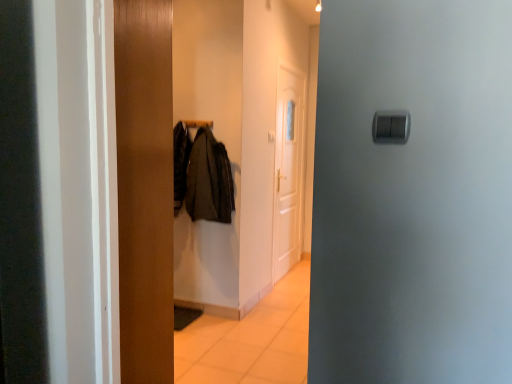
Question: From the image's perspective, is dark gray fabric coat at center beneath wooden door at center, arranged as the 2th door when viewed from the right?

Choices:
 (A) no
 (B) yes

Answer: (A)

Question: Is dark gray fabric coat at center aimed at wooden door at center, which is the 1th door from front to back?

Choices:
 (A) no
 (B) yes

Answer: (B)

Question: Does dark gray fabric coat at center have a larger size compared to wooden door at center, which is counted as the 1th door, starting from the left?

Choices:
 (A) no
 (B) yes

Answer: (A)

Question: Are dark gray fabric coat at center and wooden door at center, which is the 1th door from front to back, located far from each other?

Choices:
 (A) yes
 (B) no

Answer: (A)

Question: From the image's perspective, is dark gray fabric coat at center above wooden door at center, which is counted as the 1th door, starting from the left?

Choices:
 (A) yes
 (B) no

Answer: (A)

Question: Is point (192, 165) closer or farther from the camera than point (224, 314)?

Choices:
 (A) farther
 (B) closer

Answer: (B)

Question: Based on their sizes in the image, would you say dark gray fabric coat at center is bigger or smaller than wooden coat rack at center?

Choices:
 (A) small
 (B) big

Answer: (A)

Question: Choose the correct answer: Is dark gray fabric coat at center inside wooden coat rack at center or outside it?

Choices:
 (A) outside
 (B) inside

Answer: (A)

Question: Is dark gray fabric coat at center to the left or to the right of wooden coat rack at center in the image?

Choices:
 (A) left
 (B) right

Answer: (A)

Question: Considering the relative positions of wooden coat rack at center and metallic coat hanger at center in the image provided, is wooden coat rack at center to the left or to the right of metallic coat hanger at center?

Choices:
 (A) right
 (B) left

Answer: (A)

Question: From the image's perspective, relative to metallic coat hanger at center, is wooden coat rack at center above or below?

Choices:
 (A) below
 (B) above

Answer: (A)

Question: Considering the positions of wooden coat rack at center and metallic coat hanger at center in the image, is wooden coat rack at center taller or shorter than metallic coat hanger at center?

Choices:
 (A) short
 (B) tall

Answer: (B)

Question: Is point (147, 96) closer or farther from the camera than point (202, 120)?

Choices:
 (A) closer
 (B) farther

Answer: (A)

Question: In the image, is wooden door at center, which is counted as the 1th door, starting from the left, positioned in front of or behind wooden coat rack at center?

Choices:
 (A) front
 (B) behind

Answer: (B)

Question: Is wooden door at center, which is the 1th door from front to back, bigger or smaller than wooden coat rack at center?

Choices:
 (A) small
 (B) big

Answer: (A)